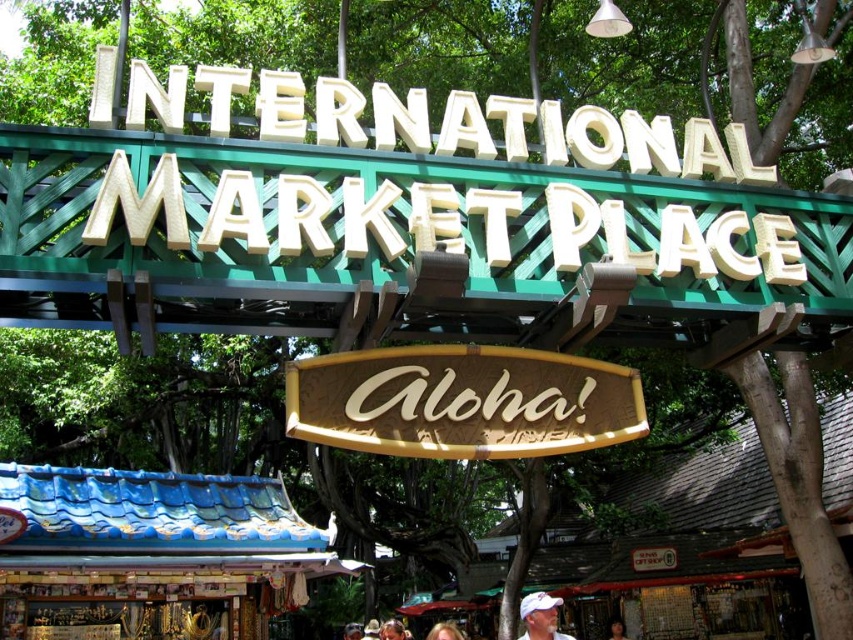
Question: From the image, what is the correct spatial relationship of white matte cap at lower center in relation to brown leather hat at center?

Choices:
 (A) below
 (B) above

Answer: (B)

Question: Is white matte cap at lower center bigger than smooth brown hair at center?

Choices:
 (A) yes
 (B) no

Answer: (A)

Question: Estimate the real-world distances between objects in this image. Which object is farther from the white matte cap at lower center?

Choices:
 (A) blonde hair at lower center
 (B) brown leather hat at center
 (C) wooden signboard at center

Answer: (B)

Question: Which object is the closest to the wooden signboard at center?

Choices:
 (A) white matte cap at lower center
 (B) brown leather hat at center
 (C) smooth brown hair at center

Answer: (A)

Question: Does brown leather hat at center come behind smooth brown hair at center?

Choices:
 (A) no
 (B) yes

Answer: (A)

Question: Among these objects, which one is farthest from the camera?

Choices:
 (A) brown leather hat at center
 (B) wooden signboard at center

Answer: (A)